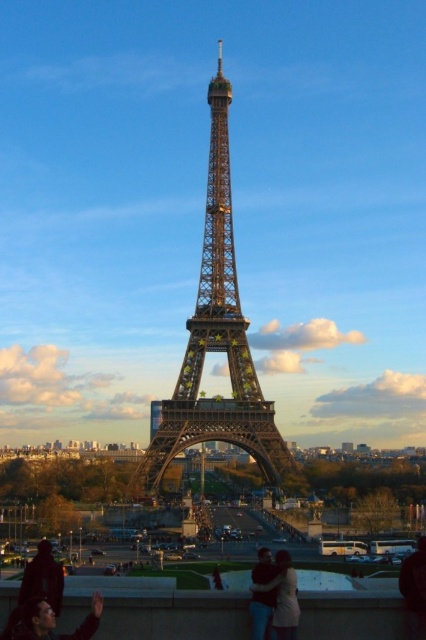
Question: Which object is the farthest from the matte black hair at lower left?

Choices:
 (A) light brown leather jacket at lower center
 (B) metallic structure at center

Answer: (B)

Question: Does metallic structure at center appear on the right side of matte black hair at lower left?

Choices:
 (A) yes
 (B) no

Answer: (A)

Question: Does metallic structure at center have a greater width compared to light brown leather jacket at lower center?

Choices:
 (A) no
 (B) yes

Answer: (B)

Question: Is metallic structure at center positioned in front of matte black hair at lower left?

Choices:
 (A) no
 (B) yes

Answer: (B)

Question: Estimate the real-world distances between objects in this image. Which object is farther from the light brown leather jacket at lower center?

Choices:
 (A) metallic structure at center
 (B) matte black hair at lower left

Answer: (A)

Question: Which object appears closest to the camera in this image?

Choices:
 (A) matte black hair at lower left
 (B) metallic structure at center
 (C) light brown leather jacket at lower center

Answer: (B)